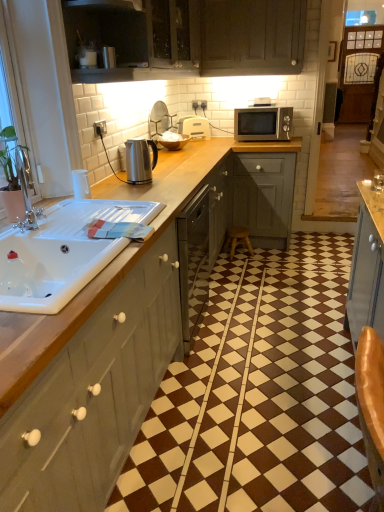
Question: Considering the relative positions of matte wood cabinet at upper center, the 2th cabinetry from the top, and white glossy sink at left in the image provided, is matte wood cabinet at upper center, the 2th cabinetry from the top, to the left or to the right of white glossy sink at left?

Choices:
 (A) right
 (B) left

Answer: (A)

Question: From a real-world perspective, is matte wood cabinet at upper center, the 2th cabinetry from the top, above or below white glossy sink at left?

Choices:
 (A) above
 (B) below

Answer: (A)

Question: Estimate the real-world distances between objects in this image. Which object is closer to the dark wood cabinet at upper center, the 3th cabinetry ordered from the bottom?

Choices:
 (A) satin silver microwave at upper right
 (B) white plastic toaster at center, marked as the 3th appliance in a front-to-back arrangement
 (C) matte wood cabinet at upper center, the 2th cabinetry from the top
 (D) satin silver kettle at center, placed as the first appliance when sorted from bottom to top
 (E) satin silver kettle at upper center, the second appliance viewed from the front

Answer: (C)

Question: Considering the real-world distances, which object is closest to the satin silver microwave at upper right?

Choices:
 (A) white plastic toaster at center, marked as the 3th appliance in a front-to-back arrangement
 (B) white glossy sink at left
 (C) dark wood cabinet at upper center, the 3th cabinetry ordered from the bottom
 (D) wooden stool at center
 (E) satin silver kettle at upper center, the 2th appliance viewed from the back

Answer: (A)